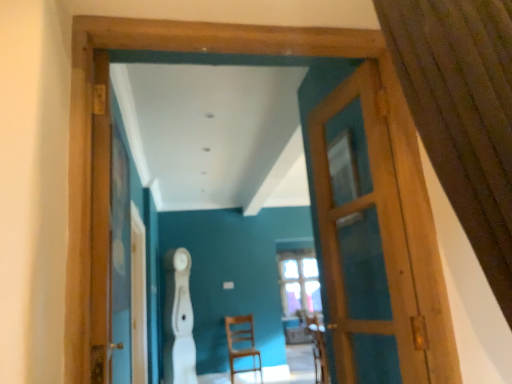
The image size is (512, 384). Describe the element at coordinates (318, 349) in the screenshot. I see `wooden armchair at center` at that location.

What do you see at coordinates (109, 238) in the screenshot?
I see `wooden screen door at left` at bounding box center [109, 238].

What is the approximate height of wooden chair at center?

wooden chair at center is 95.59 centimeters in height.

Where is `wooden armchair at center`? Image resolution: width=512 pixels, height=384 pixels. wooden armchair at center is located at coordinates 318,349.

From a real-world perspective, which is physically below, wooden door at center or wooden screen door at left?

In real-world perspective, wooden door at center is lower.

Image resolution: width=512 pixels, height=384 pixels. In order to click on door that appears behind the wooden screen door at left in this screenshot , I will do `click(365, 241)`.

Considering the relative positions of wooden door at center and wooden screen door at left in the image provided, is wooden door at center behind wooden screen door at left?

Yes, wooden door at center is further from the viewer.

Which of these two, brown textured curtain at upper right or wooden screen door at left, is bigger?

With larger size is brown textured curtain at upper right.

Between brown textured curtain at upper right and wooden screen door at left, which one appears on the left side from the viewer's perspective?

wooden screen door at left is more to the left.

From the image's perspective, which object appears higher, brown textured curtain at upper right or wooden screen door at left?

brown textured curtain at upper right, from the image's perspective.

Where is `chair that appears on the right of wooden screen door at left`? This screenshot has height=384, width=512. chair that appears on the right of wooden screen door at left is located at coordinates (240, 342).

Is wooden screen door at left to the left or to the right of wooden chair at center in the image?

Clearly, wooden screen door at left is on the left of wooden chair at center in the image.

From the image's perspective, which is above, wooden screen door at left or wooden chair at center?

From the image's view, wooden screen door at left is above.

Is wooden screen door at left looking in the opposite direction of wooden chair at center?

wooden screen door at left does not have its back to wooden chair at center.

Is there a large distance between wooden armchair at center and wooden door at center?

Yes, wooden armchair at center is far from wooden door at center.

Is wooden armchair at center at the right side of wooden door at center?

Yes, wooden armchair at center is to the right of wooden door at center.

Can you confirm if wooden armchair at center is thinner than wooden door at center?

No, wooden armchair at center is not thinner than wooden door at center.

From the image's perspective, would you say wooden armchair at center is shown under wooden door at center?

Correct, wooden armchair at center appears lower than wooden door at center in the image.

Are wooden screen door at left and brown textured curtain at upper right located far from each other?

Yes.

Is brown textured curtain at upper right located within wooden screen door at left?

No, brown textured curtain at upper right is not inside wooden screen door at left.

Visually, is wooden screen door at left positioned to the left or to the right of brown textured curtain at upper right?

In the image, wooden screen door at left appears on the left side of brown textured curtain at upper right.

From the picture: From the image's perspective, is wooden screen door at left on top of brown textured curtain at upper right?

Actually, wooden screen door at left appears below brown textured curtain at upper right in the image.

What's the angular difference between brown textured curtain at upper right and wooden door at center's facing directions?

The angular difference between brown textured curtain at upper right and wooden door at center is 10.6 degrees.

Is brown textured curtain at upper right not close to wooden door at center?

No, brown textured curtain at upper right is not far from wooden door at center.

From a real-world perspective, does brown textured curtain at upper right stand above wooden door at center?

Yes.

From the image's perspective, between wooden door at center and brown textured curtain at upper right, which one is located above?

brown textured curtain at upper right appears higher in the image.

Considering the sizes of wooden door at center and brown textured curtain at upper right in the image, is wooden door at center wider or thinner than brown textured curtain at upper right?

Considering their sizes, wooden door at center looks slimmer than brown textured curtain at upper right.

From a real-world perspective, which is physically above, wooden door at center or brown textured curtain at upper right?

brown textured curtain at upper right.

At what (x,y) coordinates should I click in order to perform the action: click on door behind the wooden screen door at left. Please return your answer as a coordinate pair (x, y). Looking at the image, I should click on (365, 241).

Where is `screen door below the brown textured curtain at upper right (from the image's perspective)`? screen door below the brown textured curtain at upper right (from the image's perspective) is located at coordinates (109, 238).

Looking at the image, which one is located closer to wooden door at center, wooden chair at center or brown textured curtain at upper right?

brown textured curtain at upper right.

Based on their spatial positions, is wooden armchair at center or wooden door at center closer to wooden chair at center?

The object closer to wooden chair at center is wooden armchair at center.

Which object lies further to the anchor point wooden door at center, brown textured curtain at upper right or wooden armchair at center?

Based on the image, wooden armchair at center appears to be further to wooden door at center.

Estimate the real-world distances between objects in this image. Which object is further from wooden armchair at center, wooden screen door at left or brown textured curtain at upper right?

brown textured curtain at upper right is further to wooden armchair at center.

From the picture: Which object lies further to the anchor point brown textured curtain at upper right, wooden chair at center or wooden door at center?

The object further to brown textured curtain at upper right is wooden chair at center.

When comparing their distances from wooden door at center, does brown textured curtain at upper right or wooden screen door at left seem further?

wooden screen door at left is further to wooden door at center.

Estimate the real-world distances between objects in this image. Which object is closer to wooden armchair at center, wooden screen door at left or wooden chair at center?

wooden chair at center.

Based on the photo, when comparing their distances from wooden armchair at center, does wooden chair at center or brown textured curtain at upper right seem closer?

The object closer to wooden armchair at center is wooden chair at center.

Where is `door between brown textured curtain at upper right and wooden chair at center in the front-back direction`? door between brown textured curtain at upper right and wooden chair at center in the front-back direction is located at coordinates (365, 241).

What are the coordinates of `armchair between wooden door at center and wooden chair at center in the front-back direction` in the screenshot? It's located at (318, 349).

Identify the location of door between wooden screen door at left and brown textured curtain at upper right. (365, 241).

Find the location of a particular element. screen door positioned between brown textured curtain at upper right and wooden armchair at center from near to far is located at coordinates (109, 238).